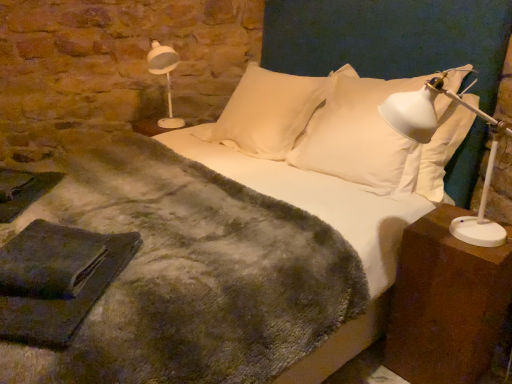
Question: Which is correct: white soft pillow at center, acting as the 2th pillow starting from the right, is inside white plastic table lamp at right, or outside of it?

Choices:
 (A) outside
 (B) inside

Answer: (A)

Question: Considering their positions, is white soft pillow at center, acting as the 2th pillow starting from the right, located in front of or behind white plastic table lamp at right?

Choices:
 (A) behind
 (B) front

Answer: (A)

Question: Based on their relative distances, which object is nearer to the white plastic lamp at upper left?

Choices:
 (A) white soft pillow at center, the first pillow from the left
 (B) brown wooden nightstand at right
 (C) white soft pillow at upper center, which is the 1th pillow in right-to-left order
 (D) white plastic table lamp at right

Answer: (A)

Question: Considering the real-world distances, which object is farthest from the white soft pillow at upper center, marked as the 2th pillow in a left-to-right arrangement?

Choices:
 (A) brown wooden nightstand at right
 (B) white plastic lamp at upper left
 (C) white soft pillow at center, the first pillow from the left
 (D) white plastic table lamp at right

Answer: (B)